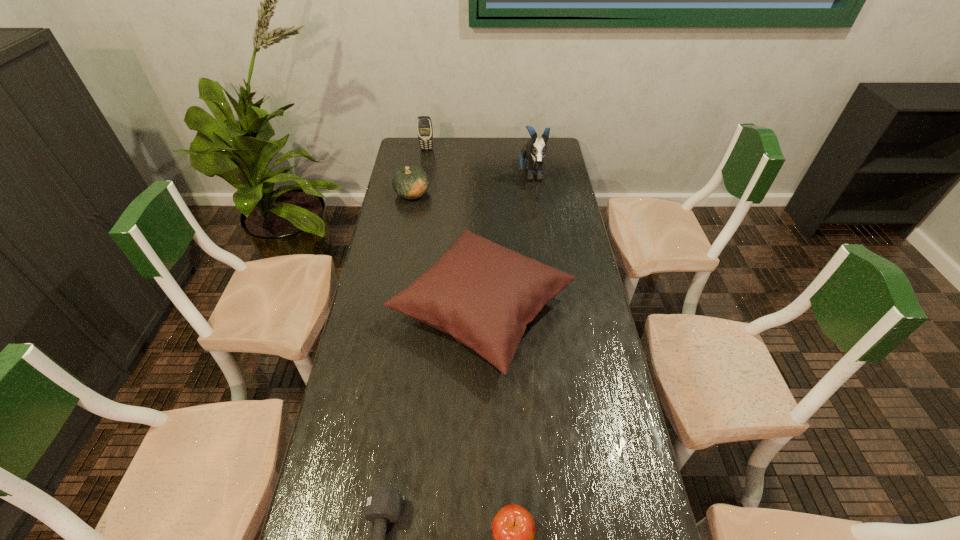
This screenshot has height=540, width=960. In the image, there is a desktop. In order to click on vacant space at the far right corner in this screenshot , I will do `click(529, 137)`.

Locate an element on the screen. The height and width of the screenshot is (540, 960). free area in between the fourth farthest object and the farthest object is located at coordinates (454, 230).

The width and height of the screenshot is (960, 540). In order to click on free area in between the farthest object and the cushion in this screenshot , I will do `click(454, 230)`.

Where is `free spot between the cellular telephone and the cushion`? free spot between the cellular telephone and the cushion is located at coordinates (454, 230).

Locate an element on the screen. This screenshot has height=540, width=960. free area in between the cushion and the tallest object is located at coordinates (507, 243).

I want to click on object identified as the second closest to the cushion, so click(382, 505).

What are the coordinates of `the closest object to the fifth tallest object` in the screenshot? It's located at (382, 505).